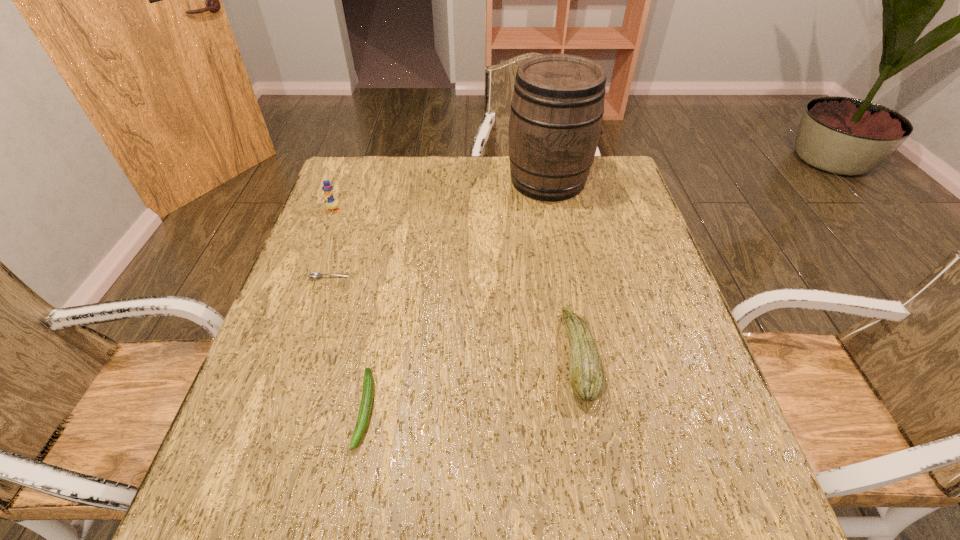
Locate an element on the screen. This screenshot has height=540, width=960. vacant space located on the front of the wine bucket is located at coordinates (566, 273).

At what (x,y) coordinates should I click in order to perform the action: click on vacant space located on the face of the fourth shortest object, where the monocle is placed. Please return your answer as a coordinate pair (x, y). This screenshot has width=960, height=540. Looking at the image, I should click on (316, 256).

Find the location of `vacant region located at the stem end of the third shortest object`. vacant region located at the stem end of the third shortest object is located at coordinates (501, 356).

Locate an element on the screen. free region located at the stem end of the third shortest object is located at coordinates coord(389,356).

At what (x,y) coordinates should I click in order to perform the action: click on free point located 0.310m at the stem end of the third shortest object. Please return your answer as a coordinate pair (x, y). The image size is (960, 540). Looking at the image, I should click on (417, 356).

Where is `vacant space situated 0.050m on the front-facing side of the left zucchini`? Image resolution: width=960 pixels, height=540 pixels. vacant space situated 0.050m on the front-facing side of the left zucchini is located at coordinates (351, 481).

At what (x,y) coordinates should I click in order to perform the action: click on vacant area situated 0.340m on the front of the shortest object. Please return your answer as a coordinate pair (x, y). Looking at the image, I should click on (287, 408).

Where is `object located in the far edge section of the desktop`? This screenshot has height=540, width=960. object located in the far edge section of the desktop is located at coordinates (557, 107).

This screenshot has width=960, height=540. Identify the location of duckling that is at the left edge. (331, 203).

You are a GUI agent. You are given a task and a screenshot of the screen. Output one action in this format:
    pyautogui.click(x=<x>, y=<y>)
    Task: Click on the soupspoon that is at the left edge
    The height and width of the screenshot is (540, 960).
    Given the screenshot: What is the action you would take?
    pyautogui.click(x=316, y=275)